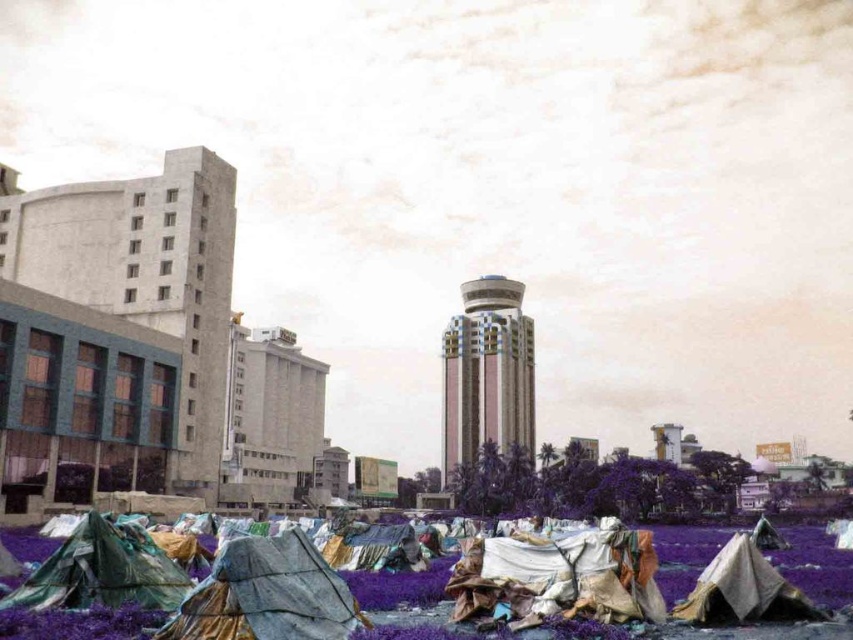
Between point (228, 564) and point (517, 336), which one is positioned behind?

Point (517, 336)

Does textured gray tarp at lower left appear over pink glossy tower at center?

Correct, textured gray tarp at lower left is located above pink glossy tower at center.

At what (x,y) coordinates should I click in order to perform the action: click on textured gray tarp at lower left. Please return your answer as a coordinate pair (x, y). Looking at the image, I should click on (267, 595).